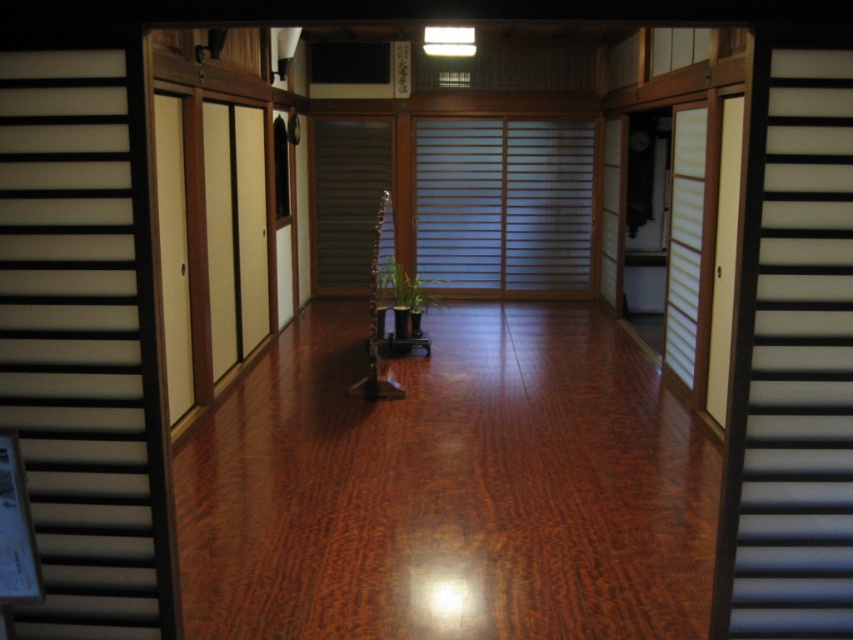
Is point (57, 342) positioned behind point (849, 541)?

No, it is in front of (849, 541).

This screenshot has width=853, height=640. In order to click on white matte sliding door at left in this screenshot , I will do `click(83, 340)`.

Can you confirm if shiny brown wood at center is positioned below brown wooden stairs at center?

Indeed, shiny brown wood at center is positioned under brown wooden stairs at center.

Which is above, shiny brown wood at center or brown wooden stairs at center?

Positioned higher is brown wooden stairs at center.

Is point (491, 316) positioned in front of point (347, 132)?

Yes.

Where is `shiny brown wood at center`? The height and width of the screenshot is (640, 853). shiny brown wood at center is located at coordinates (450, 488).

Between white matte sliding door at left and brown wooden stairs at center, which one has more height?

With more height is brown wooden stairs at center.

Can you confirm if white matte sliding door at left is positioned to the left of brown wooden stairs at center?

Correct, you'll find white matte sliding door at left to the left of brown wooden stairs at center.

Does point (131, 65) come behind point (317, 230)?

No, it is not.

Find the location of a particular element. white matte sliding door at left is located at coordinates (83, 340).